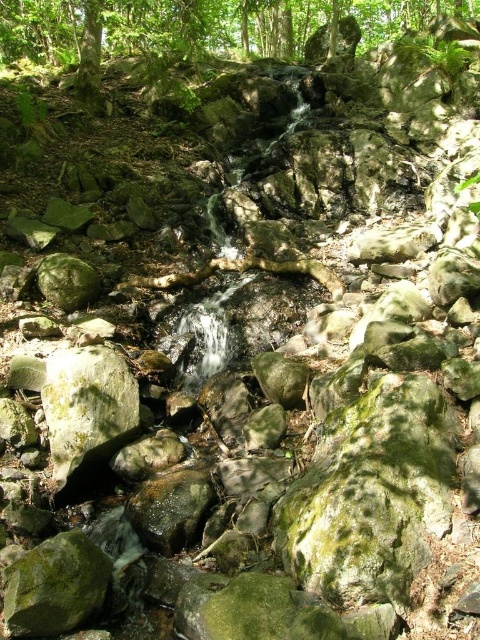
Question: Which point is closer to the camera?

Choices:
 (A) (60, 388)
 (B) (415, 6)

Answer: (A)

Question: Can you confirm if green leafy tree at upper center is positioned to the left of green mossy rock at center?

Choices:
 (A) yes
 (B) no

Answer: (B)

Question: Is green leafy tree at upper center below green mossy rock at center?

Choices:
 (A) yes
 (B) no

Answer: (B)

Question: Is green leafy tree at upper center above green mossy rock at center?

Choices:
 (A) yes
 (B) no

Answer: (A)